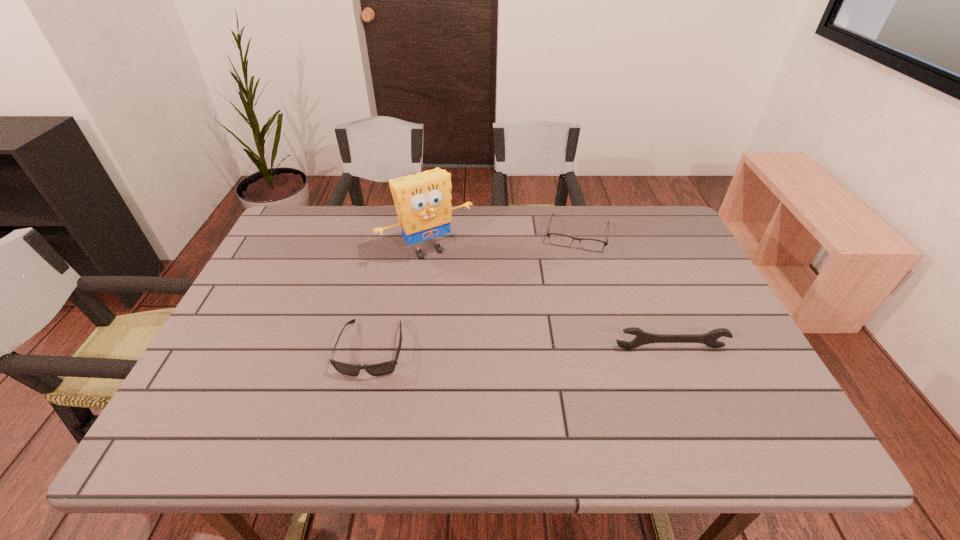
Identify the location of vacant area located 0.160m on the face of the tallest object. pos(474,301).

This screenshot has width=960, height=540. Find the location of `vacant region located 0.100m on the face of the tallest object`. vacant region located 0.100m on the face of the tallest object is located at coordinates (464, 287).

Locate an element on the screen. spectacles located at the far edge is located at coordinates (557, 239).

Locate an element on the screen. The height and width of the screenshot is (540, 960). sponge present at the far edge is located at coordinates (423, 204).

Where is `object at the near edge`? The height and width of the screenshot is (540, 960). object at the near edge is located at coordinates (384, 368).

Identify the location of object positioned at the right edge. (642, 338).

Where is `free space at the far edge of the desktop`? free space at the far edge of the desktop is located at coordinates (578, 235).

Locate an element on the screen. Image resolution: width=960 pixels, height=540 pixels. free space at the near edge is located at coordinates (631, 407).

Where is `free region at the left edge of the desktop`? free region at the left edge of the desktop is located at coordinates (273, 260).

At what (x,y) coordinates should I click in order to perform the action: click on free location at the right edge of the desktop. Please return your answer as a coordinate pair (x, y). Looking at the image, I should click on (x=703, y=352).